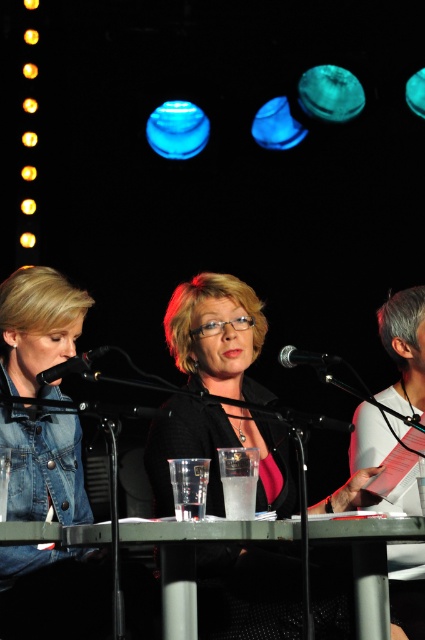
You are a stagehand preparing for the next segment of the talk show. You need to place a prop on the table directly in front of the white paper at right. Where should you place the prop in terms of coordinates?

The white paper at right is located at coordinates point (405, 348). Therefore, you should place the prop directly in front of this point on the table.

You are a sound technician adjusting the microphones for the panel discussion. You need to ensure that the black matte microphone at left and the black metallic microphone at center are set to the same height. Which microphone should you lower?

The black matte microphone at left should be lowered since it is taller than the black metallic microphone at center according to the description.

From the picture: You are a stagehand adjusting the lighting for the panel discussion. You need to ensure that the black matte microphone at left is visible under the stage lights. Given that the metallic gray table at center is taller than the microphone, where should you position the lights to best illuminate both the microphone and the table?

Since the metallic gray table at center is taller than the black matte microphone at left, positioning the lights at a lower angle would ensure both the microphone and the table are illuminated. Lower lights will cast a broader light spread, reaching the shorter microphone while also catching the taller table.